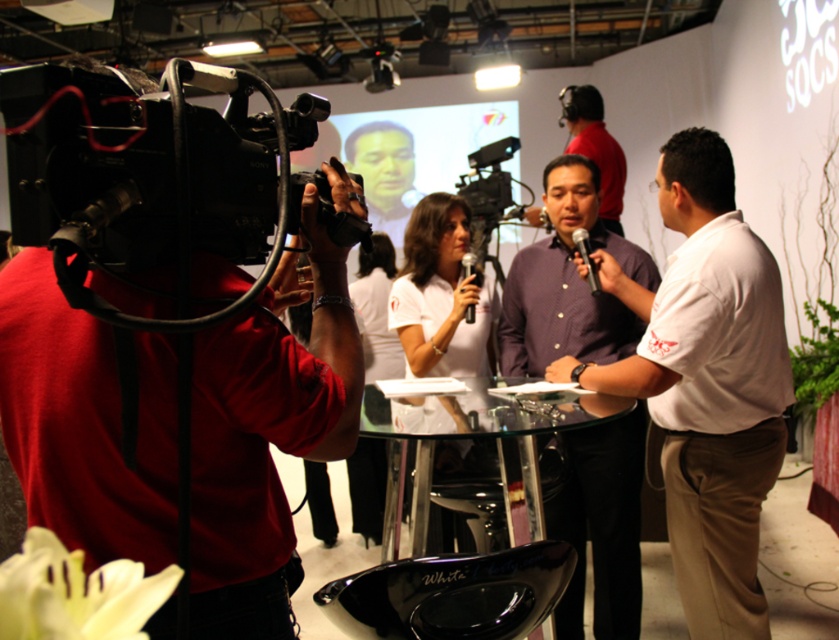
Does matte black camera at left appear on the left side of black plastic microphone at center?

Yes, matte black camera at left is to the left of black plastic microphone at center.

Is point (233, 410) farther from camera compared to point (473, 266)?

No, it is not.

The image size is (839, 640). Identify the location of matte black camera at left. click(264, 436).

The width and height of the screenshot is (839, 640). Describe the element at coordinates (527, 412) in the screenshot. I see `transparent glass table at center` at that location.

Does transparent glass table at center lie in front of black plastic microphone at center?

Yes, it is in front of black plastic microphone at center.

Between point (431, 456) and point (462, 262), which one is positioned behind?

Positioned behind is point (462, 262).

Where is `transparent glass table at center`? The height and width of the screenshot is (640, 839). transparent glass table at center is located at coordinates (527, 412).

Does matte black camera at left have a greater height compared to black metallic microphone at center?

Yes, matte black camera at left is taller than black metallic microphone at center.

Who is lower down, matte black camera at left or black metallic microphone at center?

Positioned lower is matte black camera at left.

Measure the distance between point [334,200] and camera.

They are 3.97 feet apart.

The image size is (839, 640). I want to click on matte black camera at left, so click(264, 436).